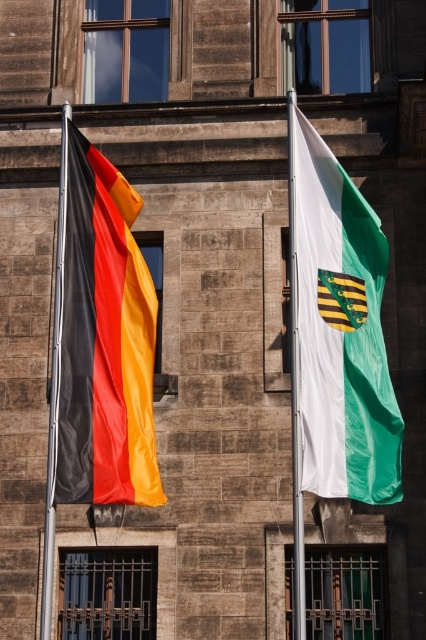
Question: Estimate the real-world distances between objects in this image. Which object is farther from the black metal flag pole at left?

Choices:
 (A) matte fabric flag at left
 (B) white fabric flag at right

Answer: (A)

Question: Which of the following is the closest to the observer?

Choices:
 (A) white fabric flag at right
 (B) black metal flag pole at left
 (C) matte fabric flag at left

Answer: (A)

Question: Which point is farther to the camera?

Choices:
 (A) click(298, 458)
 (B) click(63, 188)

Answer: (B)

Question: Is matte fabric flag at left to the right of black metal flag pole at left from the viewer's perspective?

Choices:
 (A) no
 (B) yes

Answer: (B)

Question: Is white/green fabric flag at right bigger than black metal flag pole at left?

Choices:
 (A) yes
 (B) no

Answer: (B)

Question: Where is black metal flag pole at left located in relation to white fabric flag at right in the image?

Choices:
 (A) below
 (B) above

Answer: (A)